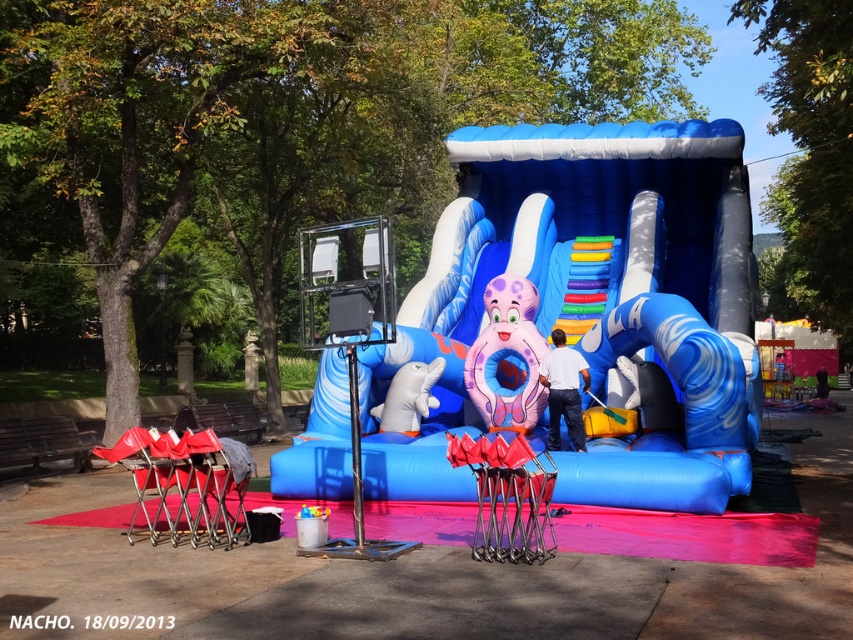
You are organizing a childrens party and need to decide where to place a new small snack table. The snack table is 1 meter wide. The scene has a pink rubber octopus at center and a metallic silver folding chair at lower left. Can the snack table fit between them without blocking the slide entrance?

The pink rubber octopus at center is larger than the metallic silver folding chair at lower left. However, since the exact distance between them isnnt provided, we cannot determine if the 1 meter wide snack table will fit. More spatial information is needed about their positioning.

You are standing at the entrance of the inflatable water slide and want to find the metallic red chair at lower left. According to the scene description, where should you look relative to the slide?

The metallic red chair at lower left is located at point coordinates [144,472] relative to the slide. Since these coordinates place it at the lower left position, you should look towards the lower left area near the slide to find the metallic red chair at lower left.